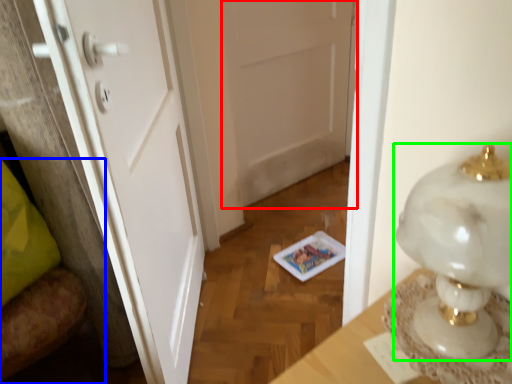
Question: Which is nearer to the door (highlighted by a red box)? furniture (highlighted by a blue box) or lamp (highlighted by a green box).

Choices:
 (A) furniture
 (B) lamp

Answer: (A)